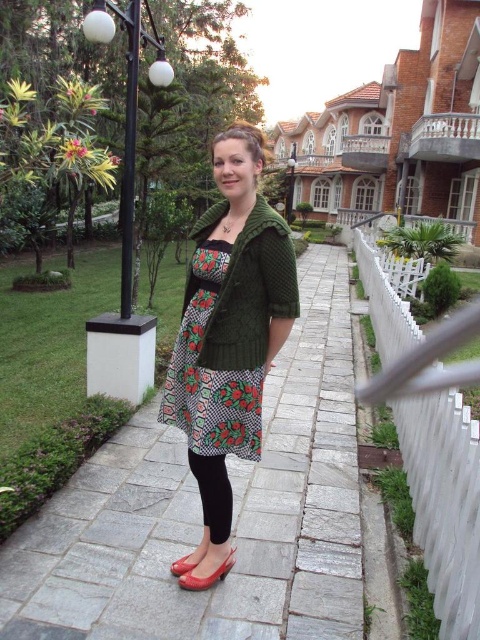
Who is positioned more to the right, floral-patterned fabric dress at center or black matte leggings at center?

black matte leggings at center

Which is above, floral-patterned fabric dress at center or black matte leggings at center?

Positioned higher is floral-patterned fabric dress at center.

Image resolution: width=480 pixels, height=640 pixels. In order to click on floral-patterned fabric dress at center in this screenshot , I will do `click(210, 372)`.

Who is higher up, green knitted jacket at center or shiny patent leather shoe at lower center?

green knitted jacket at center is above.

Is point (277, 250) positioned in front of point (186, 564)?

No, (277, 250) is behind (186, 564).

This screenshot has width=480, height=640. What are the coordinates of `green knitted jacket at center` in the screenshot? It's located at pyautogui.click(x=252, y=292).

Who is positioned more to the right, green knitted sweater at center or matte red shoe at lower center?

green knitted sweater at center is more to the right.

The image size is (480, 640). What do you see at coordinates (228, 332) in the screenshot? I see `green knitted sweater at center` at bounding box center [228, 332].

Which is in front, point (200, 449) or point (197, 588)?

Point (197, 588) is more forward.

Find the location of a particular element. green knitted sweater at center is located at coordinates (228, 332).